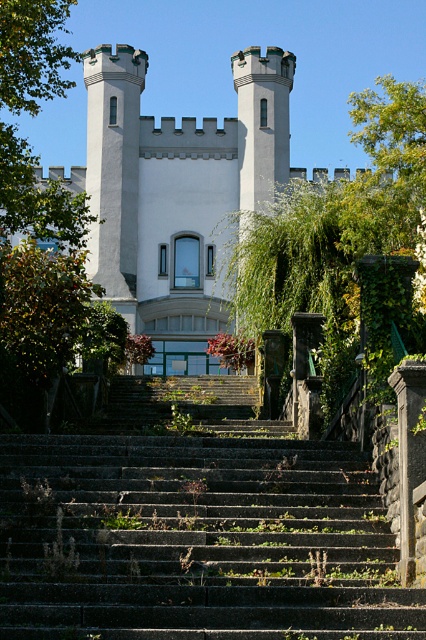
Question: Estimate the real-world distances between objects in this image. Which object is closer to the dark gray stone stairs at center?

Choices:
 (A) green leafy tree at upper left
 (B) white stone castle at center

Answer: (A)

Question: Which of the following is the farthest from the observer?

Choices:
 (A) (406, 216)
 (B) (6, 221)
 (C) (256, 202)
 (D) (75, 484)

Answer: (C)

Question: Does dark gray stone stairs at center have a larger size compared to green leafy tree at upper left?

Choices:
 (A) no
 (B) yes

Answer: (A)

Question: Which object is farther from the camera taking this photo?

Choices:
 (A) white stone castle at center
 (B) green leafy tree at center

Answer: (A)

Question: Does dark gray stone stairs at center have a lesser width compared to white stone castle at center?

Choices:
 (A) yes
 (B) no

Answer: (A)

Question: Can you confirm if white stone castle at center is wider than green leafy tree at upper left?

Choices:
 (A) no
 (B) yes

Answer: (B)